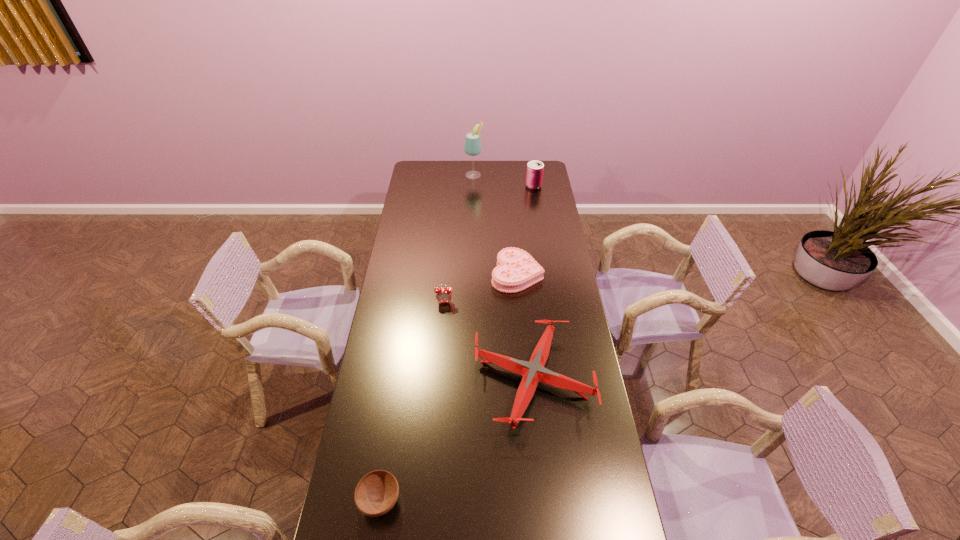
Find the location of a particular element. This screenshot has height=540, width=960. vacant space located 0.240m on the left of the farthest object is located at coordinates (423, 174).

This screenshot has height=540, width=960. Identify the location of free spot located on the left of the fifth shortest object. (482, 186).

This screenshot has width=960, height=540. Find the location of `free space located on the face of the alarm clock`. free space located on the face of the alarm clock is located at coordinates (440, 362).

The height and width of the screenshot is (540, 960). In order to click on free space located on the back of the second nearest object in this screenshot , I will do `click(527, 325)`.

Where is `vacant space located on the right of the bowl`? This screenshot has height=540, width=960. vacant space located on the right of the bowl is located at coordinates (462, 500).

Where is `blank area located 0.150m on the back of the cake`? The height and width of the screenshot is (540, 960). blank area located 0.150m on the back of the cake is located at coordinates (514, 236).

Identify the location of alcohol that is positioned at the far edge. (472, 146).

Identify the location of can that is at the far edge. Image resolution: width=960 pixels, height=540 pixels. (534, 176).

Where is `object that is at the left edge`? object that is at the left edge is located at coordinates (376, 493).

You are a GUI agent. You are given a task and a screenshot of the screen. Output one action in this format:
    pyautogui.click(x=<x>, y=<y>)
    Task: Click on the can at the right edge
    Image resolution: width=960 pixels, height=540 pixels.
    Given the screenshot: What is the action you would take?
    pyautogui.click(x=534, y=176)